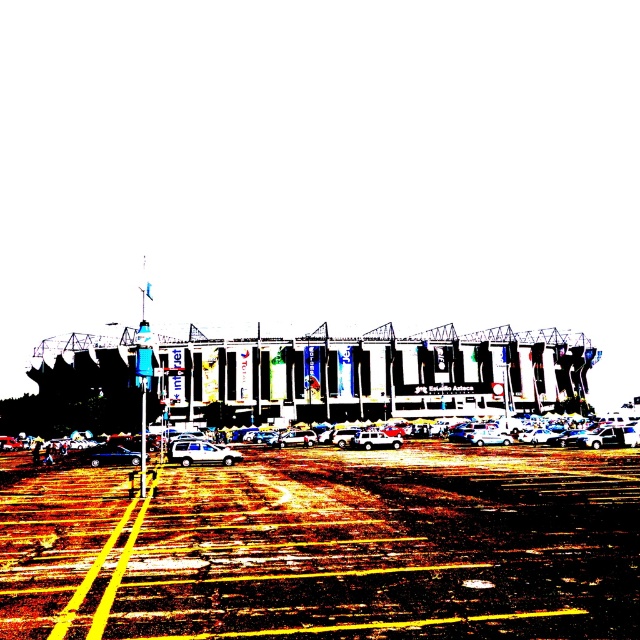
Does white glossy car at center appear over metallic silver suv at center?

Yes, white glossy car at center is above metallic silver suv at center.

Is point (182, 456) in front of point (392, 442)?

Yes, point (182, 456) is closer to viewer.

Which is in front, point (205, 452) or point (362, 433)?

Point (205, 452) is in front.

Where is `white glossy car at center`? This screenshot has height=640, width=640. white glossy car at center is located at coordinates (200, 452).

Does brown asphalt parking lot at center have a smaller size compared to shiny metallic car at center?

Incorrect, brown asphalt parking lot at center is not smaller in size than shiny metallic car at center.

Does brown asphalt parking lot at center lie in front of shiny metallic car at center?

Yes.

Is point (524, 486) positioned before point (100, 464)?

That is True.

The width and height of the screenshot is (640, 640). Identify the location of brown asphalt parking lot at center. (330, 547).

Is point (163, 560) farther from viewer compared to point (388, 445)?

No, (163, 560) is closer to viewer.

Does brown asphalt parking lot at center come behind metallic silver suv at center?

No, it is in front of metallic silver suv at center.

What are the coordinates of `brown asphalt parking lot at center` in the screenshot? It's located at (330, 547).